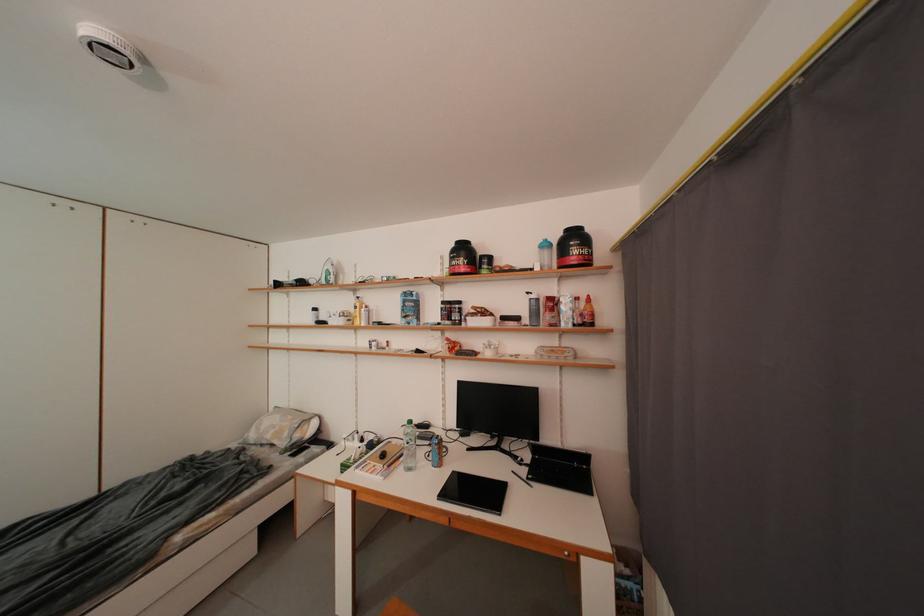
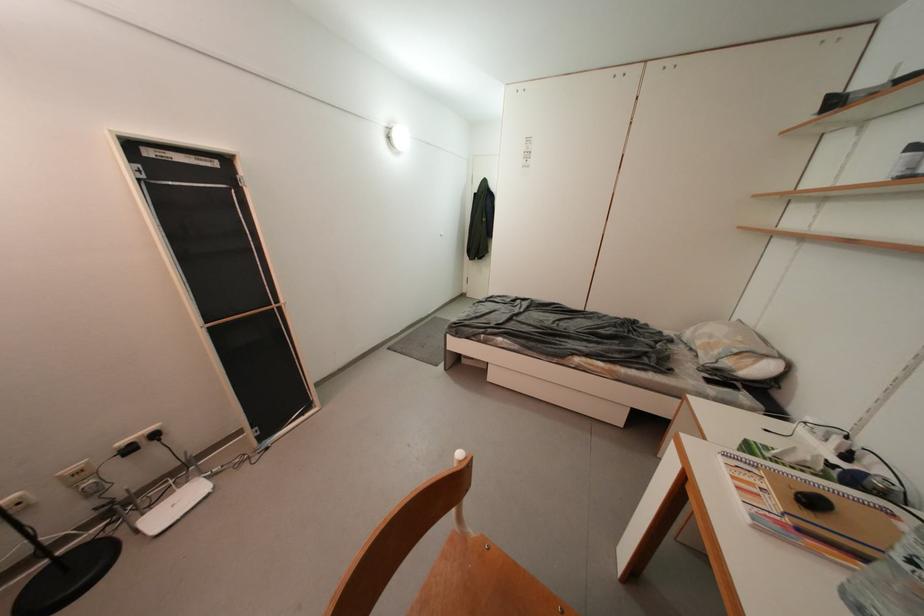
The images are taken continuously from a first-person perspective. In which direction is your viewpoint rotating?

The camera rotated toward left-down.